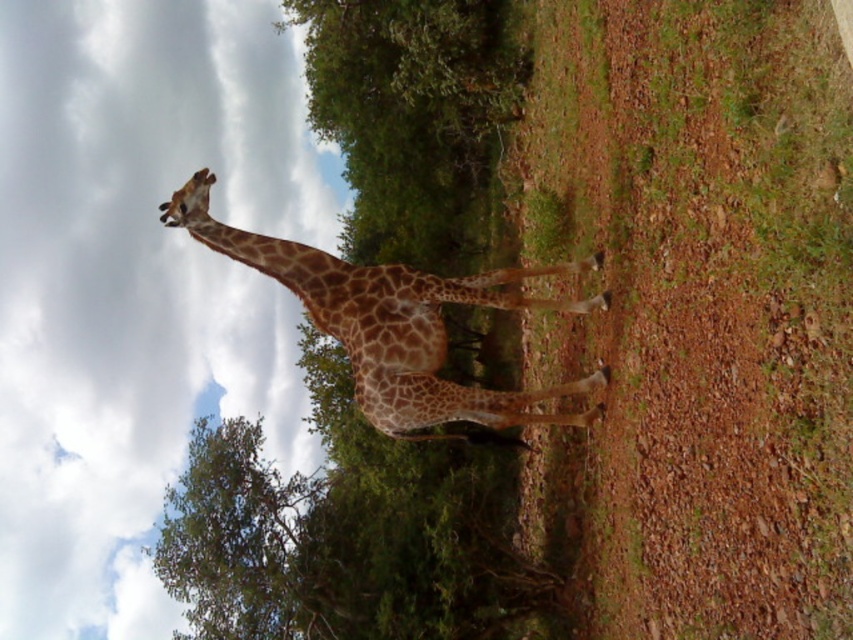
Which of these two, brown textured grass at center or spotted fur giraffe at center, stands taller?

brown textured grass at center

Which is more to the left, brown textured grass at center or spotted fur giraffe at center?

spotted fur giraffe at center

What do you see at coordinates (659, 289) in the screenshot? The height and width of the screenshot is (640, 853). I see `brown textured grass at center` at bounding box center [659, 289].

The image size is (853, 640). What are the coordinates of `brown textured grass at center` in the screenshot? It's located at (659, 289).